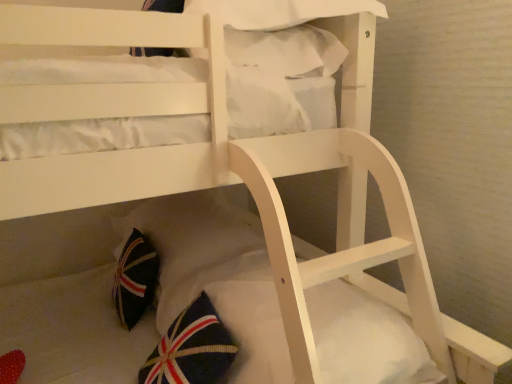
In order to face white fabric pillow at upper center, which is counted as the 2th pillow, starting from the bottom, should I rotate leftwards or rightwards?

To align with it, rotate left about 2.723°.

What do you see at coordinates (73, 331) in the screenshot? I see `white soft mattress at lower center` at bounding box center [73, 331].

Find the location of `white fabric pillow at upper center, the 1th pillow positioned from the top`. white fabric pillow at upper center, the 1th pillow positioned from the top is located at coordinates (280, 11).

Locate an element on the screen. Image resolution: width=512 pixels, height=384 pixels. mattress on the right of dark blue fabric pillow at lower center, which appears as the second pillow when viewed from the top is located at coordinates (73, 331).

How many degrees apart are the facing directions of white soft mattress at lower center and dark blue fabric pillow at lower center, which appears as the second pillow when viewed from the top?

0.000189 degrees separate the facing orientations of white soft mattress at lower center and dark blue fabric pillow at lower center, which appears as the second pillow when viewed from the top.

Which of these two, white soft mattress at lower center or dark blue fabric pillow at lower center, the first pillow ordered from the bottom, is bigger?

dark blue fabric pillow at lower center, the first pillow ordered from the bottom.

Looking at this image, from a real-world perspective, is white soft mattress at lower center physically below dark blue fabric pillow at lower center, which appears as the second pillow when viewed from the top?

Yes, from a real-world perspective, white soft mattress at lower center is under dark blue fabric pillow at lower center, which appears as the second pillow when viewed from the top.

Considering the relative sizes of white soft mattress at lower center and white fabric pillow at upper center, which is counted as the 2th pillow, starting from the bottom, in the image provided, is white soft mattress at lower center taller than white fabric pillow at upper center, which is counted as the 2th pillow, starting from the bottom,?

Yes.

From the image's perspective, is white soft mattress at lower center located above white fabric pillow at upper center, which is counted as the 2th pillow, starting from the bottom?

Incorrect, from the image's perspective, white soft mattress at lower center is lower than white fabric pillow at upper center, which is counted as the 2th pillow, starting from the bottom.

Which is farther from the camera, (131,352) or (351,1)?

Point (131,352)

Can we say white fabric pillow at upper center, the 1th pillow positioned from the top, lies outside white soft mattress at lower center?

Yes, white fabric pillow at upper center, the 1th pillow positioned from the top, is located beyond the bounds of white soft mattress at lower center.

Is point (222, 16) in front of point (23, 346)?

Yes, it is in front of point (23, 346).

Is white fabric pillow at upper center, which is counted as the 2th pillow, starting from the bottom, taller than white soft mattress at lower center?

No, white fabric pillow at upper center, which is counted as the 2th pillow, starting from the bottom, is not taller than white soft mattress at lower center.

Could you measure the distance between white fabric pillow at upper center, which is counted as the 2th pillow, starting from the bottom, and white soft mattress at lower center?

The distance of white fabric pillow at upper center, which is counted as the 2th pillow, starting from the bottom, from white soft mattress at lower center is 31.38 inches.

From the image's perspective, is dark blue fabric pillow at lower center, which appears as the second pillow when viewed from the top, above white soft mattress at lower center?

Yes.

How many degrees apart are the facing directions of dark blue fabric pillow at lower center, which appears as the second pillow when viewed from the top, and white soft mattress at lower center?

The facing directions of dark blue fabric pillow at lower center, which appears as the second pillow when viewed from the top, and white soft mattress at lower center are 0.000189 degrees apart.

Is point (188, 249) closer or farther from the camera than point (77, 298)?

Clearly, point (188, 249) is closer to the camera than point (77, 298).

Considering the relative positions of dark blue fabric pillow at lower center, which appears as the second pillow when viewed from the top, and white soft mattress at lower center in the image provided, is dark blue fabric pillow at lower center, which appears as the second pillow when viewed from the top, to the left of white soft mattress at lower center from the viewer's perspective?

Yes, dark blue fabric pillow at lower center, which appears as the second pillow when viewed from the top, is to the left of white soft mattress at lower center.

Considering the sizes of objects dark blue fabric pillow at lower center, which appears as the second pillow when viewed from the top, and white fabric pillow at upper center, the 1th pillow positioned from the top, in the image provided, who is wider, dark blue fabric pillow at lower center, which appears as the second pillow when viewed from the top, or white fabric pillow at upper center, the 1th pillow positioned from the top,?

Wider between the two is dark blue fabric pillow at lower center, which appears as the second pillow when viewed from the top.

Can you confirm if dark blue fabric pillow at lower center, which appears as the second pillow when viewed from the top, is positioned to the right of white fabric pillow at upper center, the 1th pillow positioned from the top?

Incorrect, dark blue fabric pillow at lower center, which appears as the second pillow when viewed from the top, is not on the right side of white fabric pillow at upper center, the 1th pillow positioned from the top.

In the scene shown: From the image's perspective, between dark blue fabric pillow at lower center, which appears as the second pillow when viewed from the top, and white fabric pillow at upper center, which is counted as the 2th pillow, starting from the bottom, who is located below?

dark blue fabric pillow at lower center, which appears as the second pillow when viewed from the top, from the image's perspective.

Looking at this image, does dark blue fabric pillow at lower center, which appears as the second pillow when viewed from the top, lie in front of white fabric pillow at upper center, the 1th pillow positioned from the top?

No, it is behind white fabric pillow at upper center, the 1th pillow positioned from the top.

Would you say white fabric pillow at upper center, the 1th pillow positioned from the top, is inside or outside dark blue fabric pillow at lower center, which appears as the second pillow when viewed from the top?

white fabric pillow at upper center, the 1th pillow positioned from the top, is located beyond the bounds of dark blue fabric pillow at lower center, which appears as the second pillow when viewed from the top.

Considering the sizes of white fabric pillow at upper center, the 1th pillow positioned from the top, and dark blue fabric pillow at lower center, the first pillow ordered from the bottom, in the image, is white fabric pillow at upper center, the 1th pillow positioned from the top, taller or shorter than dark blue fabric pillow at lower center, the first pillow ordered from the bottom,?

In the image, white fabric pillow at upper center, the 1th pillow positioned from the top, appears to be shorter than dark blue fabric pillow at lower center, the first pillow ordered from the bottom.

Is white fabric pillow at upper center, the 1th pillow positioned from the top, touching dark blue fabric pillow at lower center, the first pillow ordered from the bottom?

No, white fabric pillow at upper center, the 1th pillow positioned from the top, is not with dark blue fabric pillow at lower center, the first pillow ordered from the bottom.

Looking at this image, can you tell me how much white fabric pillow at upper center, the 1th pillow positioned from the top, and dark blue fabric pillow at lower center, which appears as the second pillow when viewed from the top, differ in facing direction?

1.05 degrees separate the facing orientations of white fabric pillow at upper center, the 1th pillow positioned from the top, and dark blue fabric pillow at lower center, which appears as the second pillow when viewed from the top.

I want to click on mattress below the dark blue fabric pillow at lower center, the first pillow ordered from the bottom (from the image's perspective), so click(73, 331).

I want to click on mattress on the right side of white fabric pillow at upper center, which is counted as the 2th pillow, starting from the bottom, so click(x=73, y=331).

Looking at the image, which one is located further to dark blue fabric pillow at lower center, which appears as the second pillow when viewed from the top, white soft mattress at lower center or white fabric pillow at upper center, the 1th pillow positioned from the top?

white fabric pillow at upper center, the 1th pillow positioned from the top.

Looking at the image, which one is located further to dark blue fabric pillow at lower center, which appears as the second pillow when viewed from the top, white fabric pillow at upper center, which is counted as the 2th pillow, starting from the bottom, or white soft mattress at lower center?

Among the two, white fabric pillow at upper center, which is counted as the 2th pillow, starting from the bottom, is located further to dark blue fabric pillow at lower center, which appears as the second pillow when viewed from the top.

Looking at the image, which one is located further to white fabric pillow at upper center, the 1th pillow positioned from the top, white soft mattress at lower center or dark blue fabric pillow at lower center, which appears as the second pillow when viewed from the top?

The object further to white fabric pillow at upper center, the 1th pillow positioned from the top, is white soft mattress at lower center.

From the image, which object appears to be nearer to white soft mattress at lower center, white fabric pillow at upper center, which is counted as the 2th pillow, starting from the bottom, or dark blue fabric pillow at lower center, which appears as the second pillow when viewed from the top?

The object closer to white soft mattress at lower center is dark blue fabric pillow at lower center, which appears as the second pillow when viewed from the top.

When comparing their distances from white soft mattress at lower center, does dark blue fabric pillow at lower center, the first pillow ordered from the bottom, or white fabric pillow at upper center, the 1th pillow positioned from the top, seem further?

Based on the image, white fabric pillow at upper center, the 1th pillow positioned from the top, appears to be further to white soft mattress at lower center.

From the image, which object appears to be farther from white fabric pillow at upper center, the 1th pillow positioned from the top, dark blue fabric pillow at lower center, the first pillow ordered from the bottom, or white soft mattress at lower center?

white soft mattress at lower center is further to white fabric pillow at upper center, the 1th pillow positioned from the top.

The height and width of the screenshot is (384, 512). Find the location of `pillow between white fabric pillow at upper center, the 1th pillow positioned from the top, and white soft mattress at lower center vertically`. pillow between white fabric pillow at upper center, the 1th pillow positioned from the top, and white soft mattress at lower center vertically is located at coordinates (192, 232).